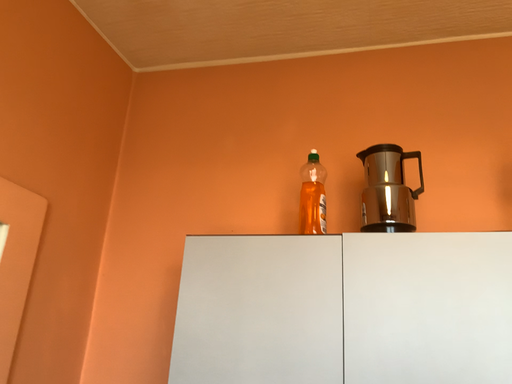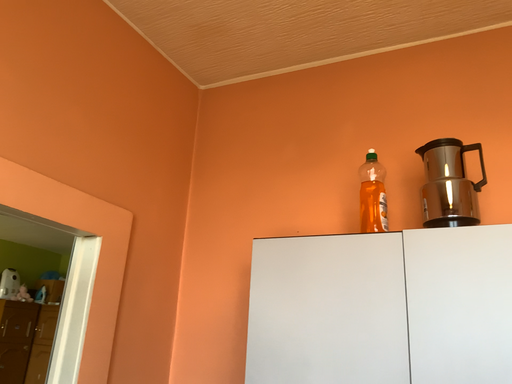
Question: How did the camera likely rotate when shooting the video?

Choices:
 (A) rotated left
 (B) rotated right

Answer: (A)